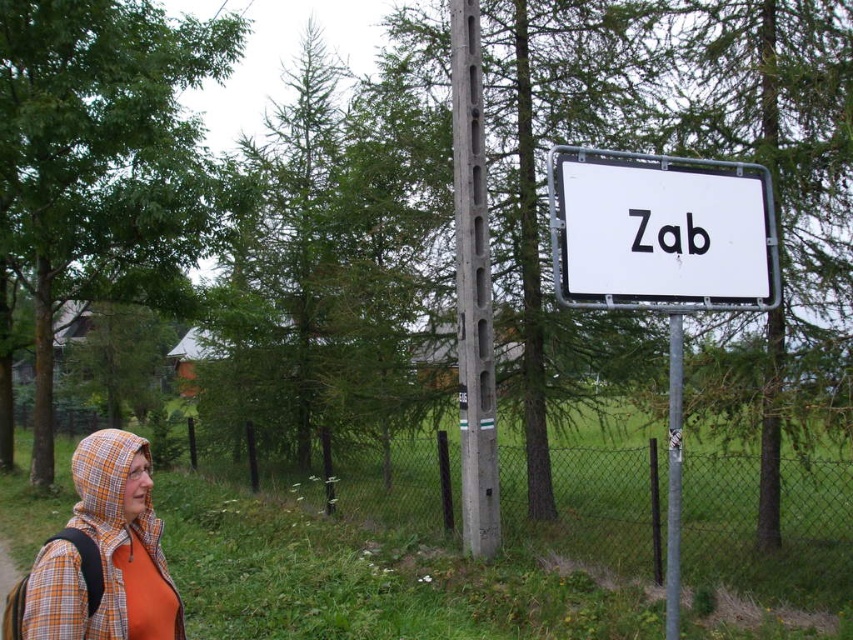
Question: Which object is positioned closest to the white plastic sign at center?

Choices:
 (A) orange plaid hood at left
 (B) white metal sign at center right

Answer: (B)

Question: Does white metal sign at center right have a greater width compared to white plastic sign at center?

Choices:
 (A) no
 (B) yes

Answer: (A)

Question: Is white metal sign at center right further to camera compared to white plastic sign at center?

Choices:
 (A) no
 (B) yes

Answer: (A)

Question: Is white plastic sign at center thinner than orange plaid hood at left?

Choices:
 (A) no
 (B) yes

Answer: (A)

Question: Which object appears closest to the camera in this image?

Choices:
 (A) white metal sign at center right
 (B) white plastic sign at center
 (C) orange plaid hood at left

Answer: (C)

Question: Which of these objects is positioned farthest from the white metal sign at center right?

Choices:
 (A) white plastic sign at center
 (B) orange plaid hood at left

Answer: (B)